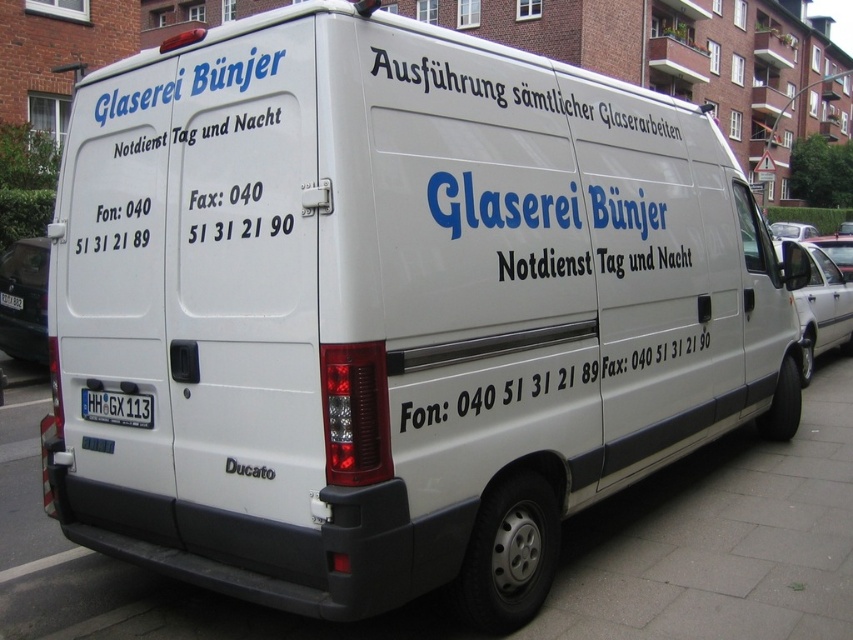
Question: Which object is the closest to the black text at upper center?

Choices:
 (A) white vinyl text at center
 (B) gray concrete pavement at lower center
 (C) white plastic license plate at rear
 (D) white plastic license plate at lower center

Answer: (A)

Question: Considering the relative positions of black text at upper center and white plastic license plate at lower center in the image provided, where is black text at upper center located with respect to white plastic license plate at lower center?

Choices:
 (A) above
 (B) below

Answer: (A)

Question: Is gray concrete pavement at lower center to the left of white vinyl text at center from the viewer's perspective?

Choices:
 (A) no
 (B) yes

Answer: (B)

Question: Does white vinyl text at center appear over white plastic license plate at rear?

Choices:
 (A) no
 (B) yes

Answer: (A)

Question: Among these objects, which one is nearest to the camera?

Choices:
 (A) white vinyl text at center
 (B) white plastic license plate at rear
 (C) gray concrete pavement at lower center
 (D) white plastic license plate at lower center

Answer: (A)

Question: Which of the following is the farthest from the observer?

Choices:
 (A) black text at upper center
 (B) gray concrete pavement at lower center
 (C) white plastic license plate at lower center
 (D) white vinyl text at center

Answer: (B)